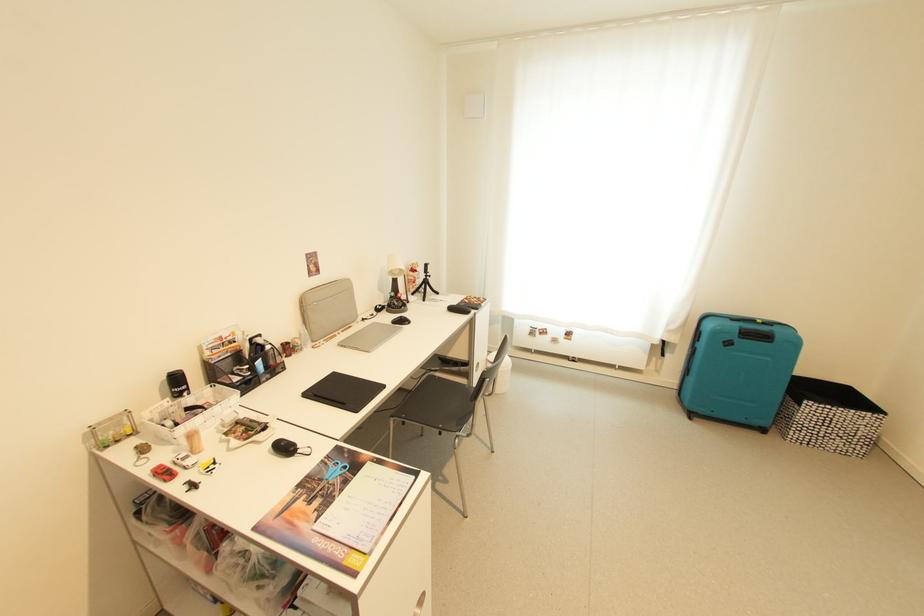
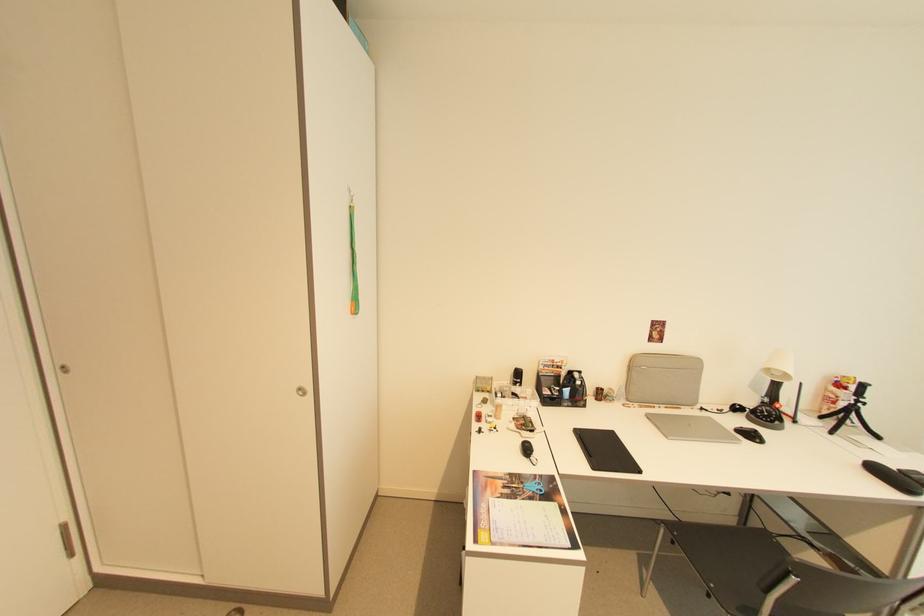
The point at (305, 505) is marked in the first image. Where is the corresponding point in the second image?

(505, 484)